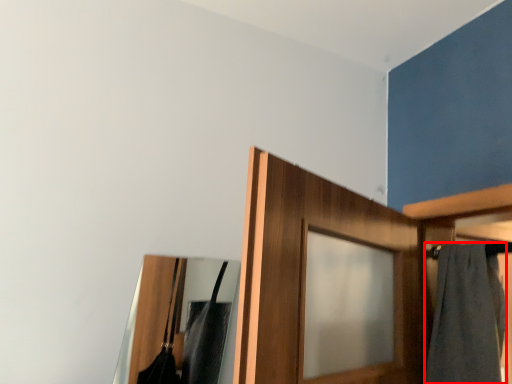
Question: From the image's perspective, where is bath towel (annotated by the red box) located relative to mirror?

Choices:
 (A) above
 (B) below

Answer: (A)